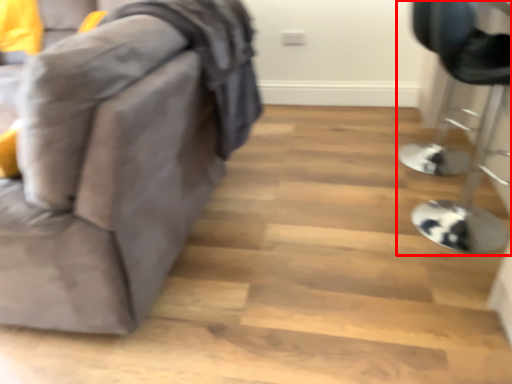
Question: In this image, where is furniture (annotated by the red box) located relative to furniture?

Choices:
 (A) right
 (B) left

Answer: (A)